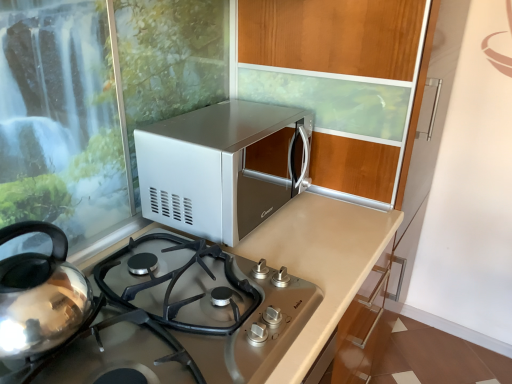
What are the coordinates of `blank space situated above satin silver microwave at upper center (from a real-world perspective)` in the screenshot? It's located at (230, 120).